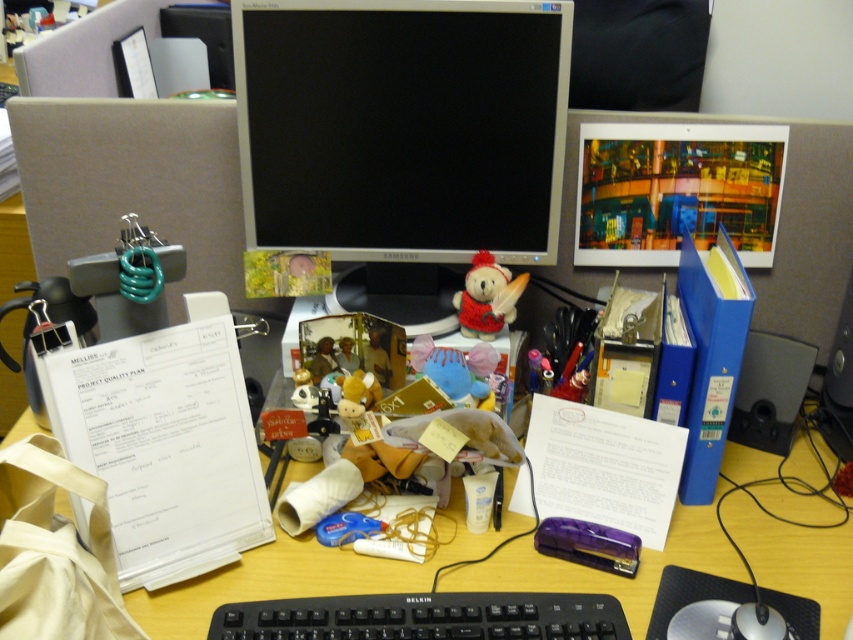
What object is located at the coordinates point (402, 128) on the desk?

The point (402, 128) marks the location of the black glossy monitor at center.

You are organizing the items on the desk and need to place a new item between the red knitted teddy bear at center and the fluffy yellow plush at center. Considering their sizes, which one should be placed closer to the edge of the desk to ensure the new item fits comfortably?

The fluffy yellow plush at center is shorter than the red knitted teddy bear at center. To fit the new item comfortably between them, place the fluffy yellow plush at center closer to the edge so there is enough space for the new item next to the taller red knitted teddy bear at center.

You are a delivery robot positioned at the center of the desk. You need to deliver a package to both the point at coordinates point (x=466, y=604) and point (x=352, y=387). Which point should you visit first to minimize the distance traveled?

You should visit point (x=466, y=604) first because it is closer to the viewer, meaning it is nearer to your current position at the center of the desk compared to point (x=352, y=387).